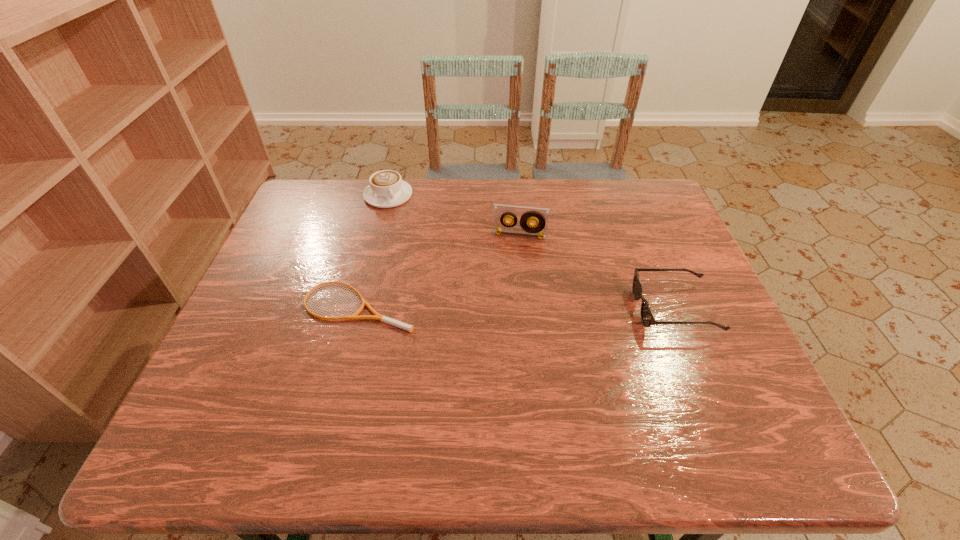
The width and height of the screenshot is (960, 540). Identify the location of free spot on the desktop that is between the tennis racket and the sunglasses and is positioned at the front of the third object from left to right with visible reels. (509, 307).

This screenshot has width=960, height=540. I want to click on vacant space on the desktop that is between the tennis racket and the sunglasses and is positioned with the handle on the right side of the cappuccino, so click(472, 307).